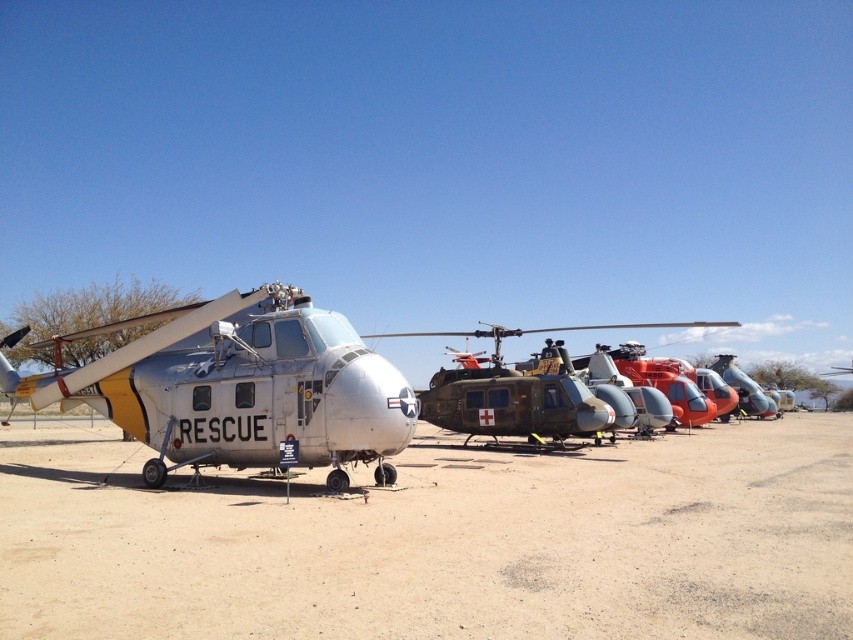
Question: Which object appears farthest from the camera in this image?

Choices:
 (A) metallic green helicopter at center
 (B) dirt field at center

Answer: (A)

Question: Where is dirt field at center located in relation to metallic green helicopter at center in the image?

Choices:
 (A) above
 (B) below

Answer: (B)

Question: Is dirt field at center smaller than metallic green helicopter at center?

Choices:
 (A) yes
 (B) no

Answer: (A)

Question: Which point appears farthest from the camera in this image?

Choices:
 (A) (815, 531)
 (B) (326, 340)

Answer: (B)

Question: Which object is positioned farthest from the silver metallic helicopter at center?

Choices:
 (A) metallic green helicopter at center
 (B) dirt field at center

Answer: (A)

Question: Can you confirm if dirt field at center is smaller than silver metallic helicopter at center?

Choices:
 (A) yes
 (B) no

Answer: (B)